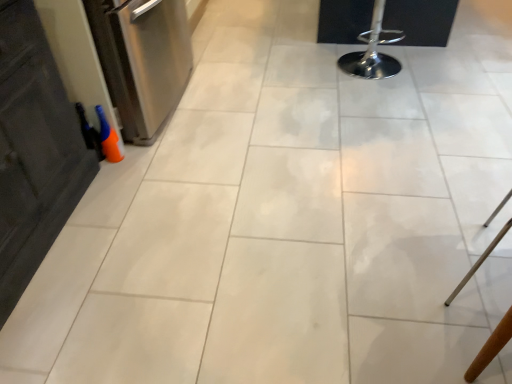
Question: From the image's perspective, is stainless steel dishwasher at left located beneath wooden chair at lower right?

Choices:
 (A) no
 (B) yes

Answer: (A)

Question: Can you confirm if stainless steel dishwasher at left is thinner than wooden chair at lower right?

Choices:
 (A) yes
 (B) no

Answer: (B)

Question: Is stainless steel dishwasher at left oriented towards wooden chair at lower right?

Choices:
 (A) yes
 (B) no

Answer: (A)

Question: Is stainless steel dishwasher at left taller than wooden chair at lower right?

Choices:
 (A) no
 (B) yes

Answer: (B)

Question: Is stainless steel dishwasher at left next to wooden chair at lower right and touching it?

Choices:
 (A) no
 (B) yes

Answer: (A)

Question: Is wooden chair at lower right wider or thinner than polished chrome bar stool at upper right?

Choices:
 (A) thin
 (B) wide

Answer: (A)

Question: From a real-world perspective, is wooden chair at lower right above or below polished chrome bar stool at upper right?

Choices:
 (A) below
 (B) above

Answer: (B)

Question: Is wooden chair at lower right to the left or to the right of polished chrome bar stool at upper right in the image?

Choices:
 (A) right
 (B) left

Answer: (A)

Question: Would you say wooden chair at lower right is inside or outside polished chrome bar stool at upper right?

Choices:
 (A) inside
 (B) outside

Answer: (B)

Question: Does point (361, 61) appear closer or farther from the camera than point (116, 21)?

Choices:
 (A) farther
 (B) closer

Answer: (A)

Question: From the image's perspective, is polished chrome bar stool at upper right positioned above or below stainless steel dishwasher at left?

Choices:
 (A) above
 (B) below

Answer: (A)

Question: In terms of size, does polished chrome bar stool at upper right appear bigger or smaller than stainless steel dishwasher at left?

Choices:
 (A) big
 (B) small

Answer: (B)

Question: From a real-world perspective, is polished chrome bar stool at upper right above or below stainless steel dishwasher at left?

Choices:
 (A) below
 (B) above

Answer: (A)

Question: Is point (501, 326) closer or farther from the camera than point (161, 51)?

Choices:
 (A) farther
 (B) closer

Answer: (B)

Question: Is wooden chair at lower right in front of or behind stainless steel dishwasher at left in the image?

Choices:
 (A) front
 (B) behind

Answer: (A)